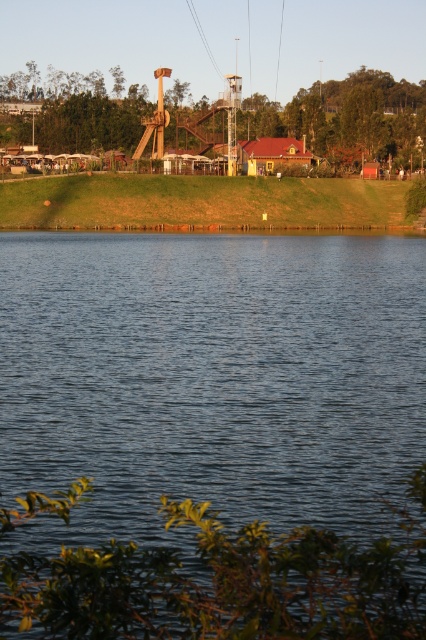
You are standing at the point labeled point (203, 202) in the image. Looking around, you see the rustic wooden slide at upper center. Which direction should you face to look towards the slide?

You should face towards the slide, which is located at the upper center of the image, so facing upwards from your current position at point (203, 202) would direct your view toward the slide.

You are standing at the edge of the lake and want to reach both the point at coordinates (x=103, y=355) and the point at (x=199, y=35). Which point will you reach first if you walk straight ahead?

You will reach point (x=103, y=355) first because it is closer to you than point (x=199, y=35).